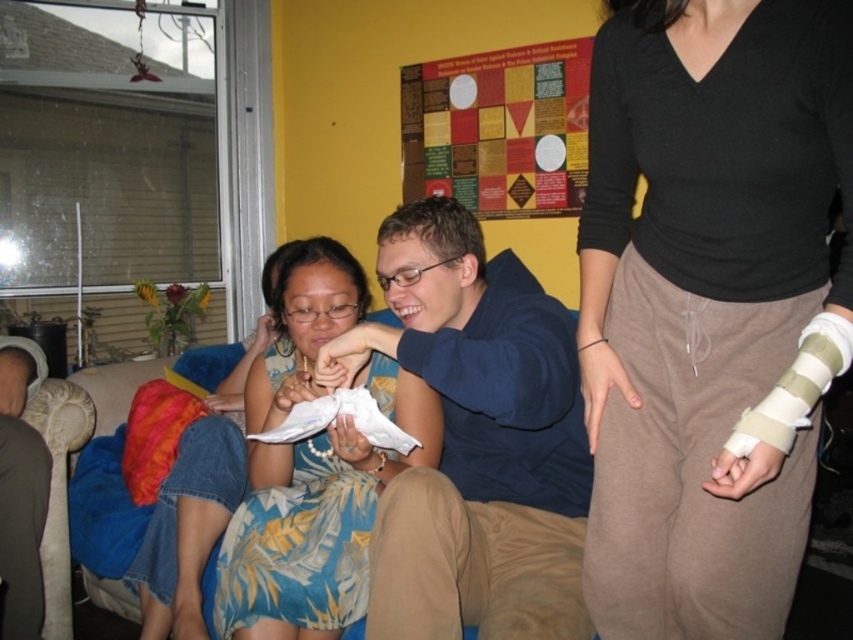
You are a photographer trying to capture a closeup of the black matte arm cast at center and the floral print dress at center. Since the camera can only focus on one object at a time, which object should you focus on first if you want to ensure the smaller object is in focus?

The black matte arm cast at center is smaller than the floral print dress at center, so you should focus on the black matte arm cast at center first to ensure it is in focus.